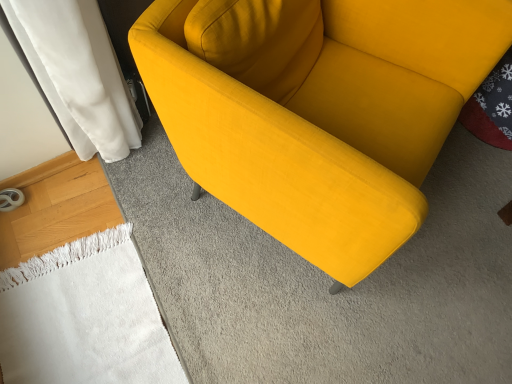
Question: Is velvet yellow couch at center behind white soft towel at lower left?

Choices:
 (A) no
 (B) yes

Answer: (A)

Question: Is velvet yellow couch at center turned away from white soft towel at lower left?

Choices:
 (A) no
 (B) yes

Answer: (A)

Question: From the image's perspective, is velvet yellow couch at center located above white soft towel at lower left?

Choices:
 (A) yes
 (B) no

Answer: (A)

Question: Can you confirm if velvet yellow couch at center is shorter than white soft towel at lower left?

Choices:
 (A) no
 (B) yes

Answer: (A)

Question: Is velvet yellow couch at center to the left of white soft towel at lower left from the viewer's perspective?

Choices:
 (A) yes
 (B) no

Answer: (B)

Question: Is velvet yellow couch at center wider than white soft towel at lower left?

Choices:
 (A) yes
 (B) no

Answer: (A)

Question: Does white soft towel at lower left have a smaller size compared to velvet yellow couch at center?

Choices:
 (A) no
 (B) yes

Answer: (B)

Question: From the image's perspective, is white soft towel at lower left beneath velvet yellow couch at center?

Choices:
 (A) no
 (B) yes

Answer: (B)

Question: Is white soft towel at lower left positioned with its back to velvet yellow couch at center?

Choices:
 (A) no
 (B) yes

Answer: (A)

Question: From the image's perspective, does white soft towel at lower left appear higher than velvet yellow couch at center?

Choices:
 (A) yes
 (B) no

Answer: (B)

Question: Can you confirm if white soft towel at lower left is thinner than velvet yellow couch at center?

Choices:
 (A) yes
 (B) no

Answer: (A)

Question: Are white soft towel at lower left and velvet yellow couch at center far apart?

Choices:
 (A) no
 (B) yes

Answer: (A)

Question: From the image's perspective, is velvet yellow couch at center positioned above or below white soft towel at lower left?

Choices:
 (A) above
 (B) below

Answer: (A)